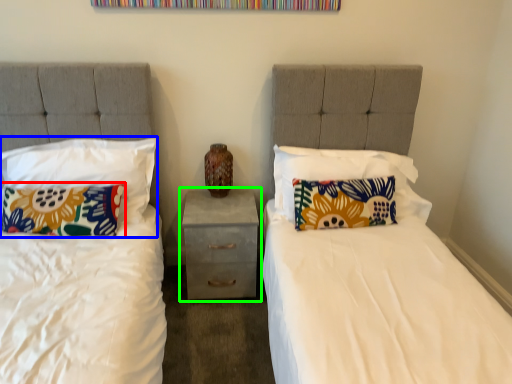
Question: Which is nearer to the pillow (highlighted by a red box)? pillow (highlighted by a blue box) or nightstand (highlighted by a green box).

Choices:
 (A) pillow
 (B) nightstand

Answer: (A)